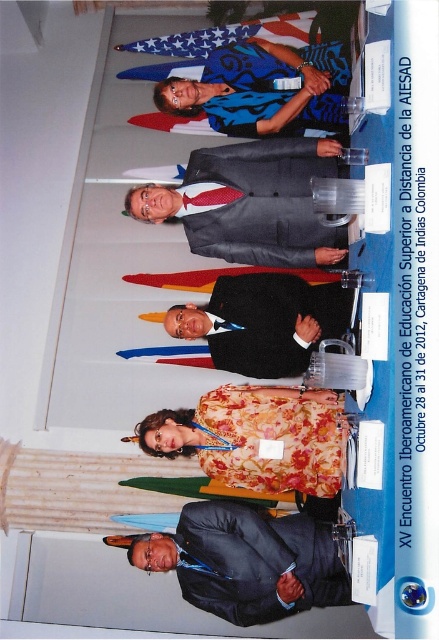
Question: Is dark gray suit at lower center positioned at the back of white star-spangled banner at upper center?

Choices:
 (A) yes
 (B) no

Answer: (B)

Question: Can you confirm if floral fabric blouse at center is wider than shiny red tie at center?

Choices:
 (A) yes
 (B) no

Answer: (A)

Question: Based on their relative distances, which object is farther from the matte gray suit at center?

Choices:
 (A) white star-spangled banner at upper center
 (B) black suit at center

Answer: (A)

Question: Among these points, which one is nearest to the camera?

Choices:
 (A) (273, 294)
 (B) (212, 42)

Answer: (A)

Question: Which point is closer to the camera?

Choices:
 (A) dark gray suit at lower center
 (B) shiny red tie at center

Answer: (A)

Question: Does matte gray suit at center have a greater width compared to black suit at center?

Choices:
 (A) no
 (B) yes

Answer: (A)